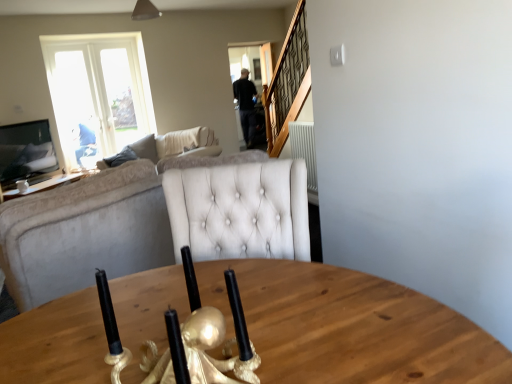
Locate an element on the screen. This screenshot has width=512, height=384. transparent glass door at upper center is located at coordinates (250, 66).

The width and height of the screenshot is (512, 384). Describe the element at coordinates (250, 66) in the screenshot. I see `transparent glass door at upper center` at that location.

Where is `velvet beige couch at left, which is the 2th studio couch in top-to-bottom order`? The height and width of the screenshot is (384, 512). velvet beige couch at left, which is the 2th studio couch in top-to-bottom order is located at coordinates (86, 233).

From the image's perspective, is white ceramic coffee cup at upper left on transparent glass door at upper center?

Incorrect, from the image's perspective, white ceramic coffee cup at upper left is lower than transparent glass door at upper center.

Is the depth of white ceramic coffee cup at upper left less than that of transparent glass door at upper center?

Yes, it is in front of transparent glass door at upper center.

Is white ceramic coffee cup at upper left looking in the opposite direction of transparent glass door at upper center?

No, white ceramic coffee cup at upper left is not facing the opposite direction of transparent glass door at upper center.

In terms of width, does white ceramic coffee cup at upper left look wider or thinner when compared to transparent glass door at upper center?

Considering their sizes, white ceramic coffee cup at upper left looks broader than transparent glass door at upper center.

Considering the sizes of white ceramic coffee cup at upper left and beige fabric couch at left, which appears as the 2th studio couch when viewed from the front, in the image, is white ceramic coffee cup at upper left bigger or smaller than beige fabric couch at left, which appears as the 2th studio couch when viewed from the front,?

Considering their sizes, white ceramic coffee cup at upper left takes up less space than beige fabric couch at left, which appears as the 2th studio couch when viewed from the front.

Is the depth of white ceramic coffee cup at upper left greater than that of beige fabric couch at left, which is the 1th studio couch in top-to-bottom order?

That is True.

Is white ceramic coffee cup at upper left to the left of beige fabric couch at left, arranged as the second studio couch when ordered from the bottom, from the viewer's perspective?

Yes.

There is a white ceramic coffee cup at upper left. Where is `the 1st studio couch above it (from a real-world perspective)`? This screenshot has height=384, width=512. the 1st studio couch above it (from a real-world perspective) is located at coordinates (177, 144).

Is velvet beige couch at left, the first studio couch in the front-to-back sequence, touching transparent glass door at upper center?

No, velvet beige couch at left, the first studio couch in the front-to-back sequence, is not in contact with transparent glass door at upper center.

Measure the distance between velvet beige couch at left, which is the 2th studio couch in top-to-bottom order, and transparent glass door at upper center.

velvet beige couch at left, which is the 2th studio couch in top-to-bottom order, is 13.83 feet away from transparent glass door at upper center.

Considering the relative positions of velvet beige couch at left, which is the 2th studio couch in top-to-bottom order, and transparent glass door at upper center in the image provided, is velvet beige couch at left, which is the 2th studio couch in top-to-bottom order, in front of transparent glass door at upper center?

Yes, it is in front of transparent glass door at upper center.

From the image's perspective, would you say velvet beige couch at left, which is the 2th studio couch in top-to-bottom order, is shown under transparent glass door at upper center?

Yes, from the image's perspective, velvet beige couch at left, which is the 2th studio couch in top-to-bottom order, is beneath transparent glass door at upper center.

Looking at this image, does transparent glass door at upper center lie in front of beige fabric couch at left, which appears as the 2th studio couch when viewed from the front?

That is False.

How different are the orientations of transparent glass door at upper center and beige fabric couch at left, arranged as the second studio couch when ordered from the bottom, in degrees?

transparent glass door at upper center and beige fabric couch at left, arranged as the second studio couch when ordered from the bottom, are facing 132 degrees away from each other.

Measure the distance between transparent glass door at upper center and beige fabric couch at left, which is the 1th studio couch in top-to-bottom order.

They are 9.84 feet apart.

Is transparent glass door at upper center bigger or smaller than beige fabric couch at left, which is the 1th studio couch in top-to-bottom order?

transparent glass door at upper center is smaller than beige fabric couch at left, which is the 1th studio couch in top-to-bottom order.

How many degrees apart are the facing directions of white ceramic coffee cup at upper left and velvet beige couch at left, acting as the first studio couch starting from the bottom?

They differ by 98.2 degrees in their facing directions.

Could you tell me if white ceramic coffee cup at upper left is turned towards velvet beige couch at left, which appears as the 2th studio couch when viewed from the back?

No, white ceramic coffee cup at upper left does not turn towards velvet beige couch at left, which appears as the 2th studio couch when viewed from the back.

Between white ceramic coffee cup at upper left and velvet beige couch at left, which appears as the 2th studio couch when viewed from the back, which one has larger size?

Bigger between the two is velvet beige couch at left, which appears as the 2th studio couch when viewed from the back.

Which object is closer to the camera taking this photo, white ceramic coffee cup at upper left or velvet beige couch at left, which appears as the 2th studio couch when viewed from the back?

velvet beige couch at left, which appears as the 2th studio couch when viewed from the back, is closer to the camera.

Considering the points (153, 153) and (234, 99), which point is in front, point (153, 153) or point (234, 99)?

The point (153, 153) is more forward.

Is beige fabric couch at left, acting as the first studio couch starting from the back, facing towards transparent glass door at upper center?

No, beige fabric couch at left, acting as the first studio couch starting from the back, does not turn towards transparent glass door at upper center.

Which is in front, beige fabric couch at left, which appears as the 2th studio couch when viewed from the front, or transparent glass door at upper center?

beige fabric couch at left, which appears as the 2th studio couch when viewed from the front.

The image size is (512, 384). In order to click on studio couch that is the 1st one when counting downward from the transparent glass door at upper center (from the image's perspective) in this screenshot , I will do `click(177, 144)`.

From the image's perspective, relative to beige fabric couch at left, arranged as the second studio couch when ordered from the bottom, is velvet beige couch at left, the first studio couch in the front-to-back sequence, above or below?

From the image's perspective, velvet beige couch at left, the first studio couch in the front-to-back sequence, appears below beige fabric couch at left, arranged as the second studio couch when ordered from the bottom.

Who is smaller, velvet beige couch at left, which is the 2th studio couch in top-to-bottom order, or beige fabric couch at left, arranged as the second studio couch when ordered from the bottom?

Smaller between the two is velvet beige couch at left, which is the 2th studio couch in top-to-bottom order.

Are velvet beige couch at left, which appears as the 2th studio couch when viewed from the back, and beige fabric couch at left, arranged as the second studio couch when ordered from the bottom, far apart?

velvet beige couch at left, which appears as the 2th studio couch when viewed from the back, is near beige fabric couch at left, arranged as the second studio couch when ordered from the bottom, not far away.

From a real-world perspective, is velvet beige couch at left, acting as the first studio couch starting from the bottom, below beige fabric couch at left, acting as the first studio couch starting from the back?

No, from a real-world perspective, velvet beige couch at left, acting as the first studio couch starting from the bottom, is not under beige fabric couch at left, acting as the first studio couch starting from the back.

Locate an element on the screen. This screenshot has width=512, height=384. coffee cup directly beneath the transparent glass door at upper center (from a real-world perspective) is located at coordinates (22, 186).

The width and height of the screenshot is (512, 384). Identify the location of studio couch above the white ceramic coffee cup at upper left (from the image's perspective). (177, 144).

When comparing their distances from beige fabric couch at left, which is the 1th studio couch in top-to-bottom order, does white ceramic coffee cup at upper left or velvet beige couch at left, acting as the first studio couch starting from the bottom, seem closer?

velvet beige couch at left, acting as the first studio couch starting from the bottom.

Consider the image. Estimate the real-world distances between objects in this image. Which object is closer to velvet beige couch at left, which appears as the 2th studio couch when viewed from the back, beige fabric couch at left, which appears as the 2th studio couch when viewed from the front, or transparent glass door at upper center?

beige fabric couch at left, which appears as the 2th studio couch when viewed from the front, is closer to velvet beige couch at left, which appears as the 2th studio couch when viewed from the back.

Consider the image. Considering their positions, is velvet beige couch at left, the first studio couch in the front-to-back sequence, positioned further to beige fabric couch at left, which is the 1th studio couch in top-to-bottom order, than white ceramic coffee cup at upper left?

The object further to beige fabric couch at left, which is the 1th studio couch in top-to-bottom order, is white ceramic coffee cup at upper left.

Looking at the image, which one is located closer to white ceramic coffee cup at upper left, velvet beige couch at left, which is the 2th studio couch in top-to-bottom order, or beige fabric couch at left, arranged as the second studio couch when ordered from the bottom?

The object closer to white ceramic coffee cup at upper left is velvet beige couch at left, which is the 2th studio couch in top-to-bottom order.

Estimate the real-world distances between objects in this image. Which object is closer to white ceramic coffee cup at upper left, transparent glass door at upper center or velvet beige couch at left, which is the 2th studio couch in top-to-bottom order?

velvet beige couch at left, which is the 2th studio couch in top-to-bottom order, is positioned closer to the anchor white ceramic coffee cup at upper left.

Considering their positions, is beige fabric couch at left, which appears as the 2th studio couch when viewed from the front, positioned further to transparent glass door at upper center than white ceramic coffee cup at upper left?

white ceramic coffee cup at upper left is positioned further to the anchor transparent glass door at upper center.

Based on their spatial positions, is white ceramic coffee cup at upper left or velvet beige couch at left, acting as the first studio couch starting from the bottom, closer to transparent glass door at upper center?

Among the two, white ceramic coffee cup at upper left is located nearer to transparent glass door at upper center.

Estimate the real-world distances between objects in this image. Which object is further from transparent glass door at upper center, velvet beige couch at left, the first studio couch in the front-to-back sequence, or white ceramic coffee cup at upper left?

velvet beige couch at left, the first studio couch in the front-to-back sequence, lies further to transparent glass door at upper center than the other object.

The image size is (512, 384). In order to click on studio couch between velvet beige couch at left, the first studio couch in the front-to-back sequence, and white ceramic coffee cup at upper left in the front-back direction in this screenshot , I will do `click(177, 144)`.

Locate an element on the screen. studio couch located between velvet beige couch at left, which appears as the 2th studio couch when viewed from the back, and transparent glass door at upper center in the depth direction is located at coordinates (177, 144).

In order to click on coffee cup between beige fabric couch at left, acting as the first studio couch starting from the back, and transparent glass door at upper center in the front-back direction in this screenshot , I will do `click(22, 186)`.

Identify the location of coffee cup between velvet beige couch at left, which is the 2th studio couch in top-to-bottom order, and transparent glass door at upper center from front to back. (22, 186).